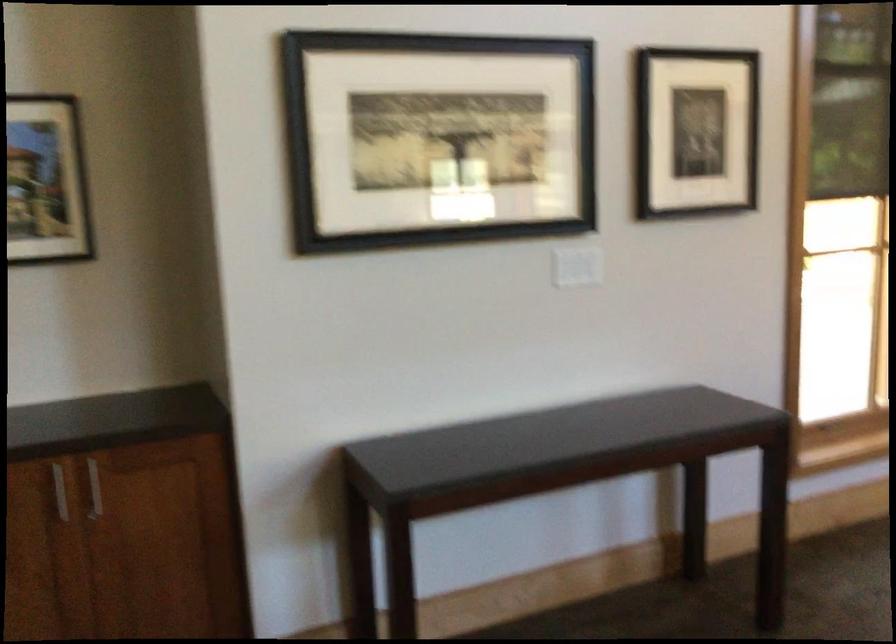
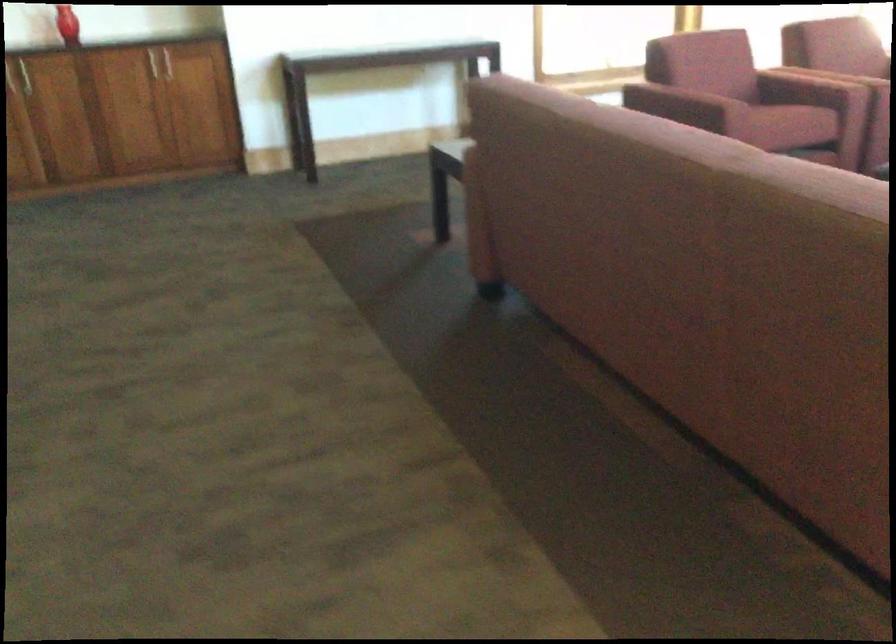
Question: Which direction would the cameraman need to move to produce the second image? Reply with the corresponding letter.

Choices:
 (A) Left
 (B) Right
 (C) Forward
 (D) Backward

Answer: (D)